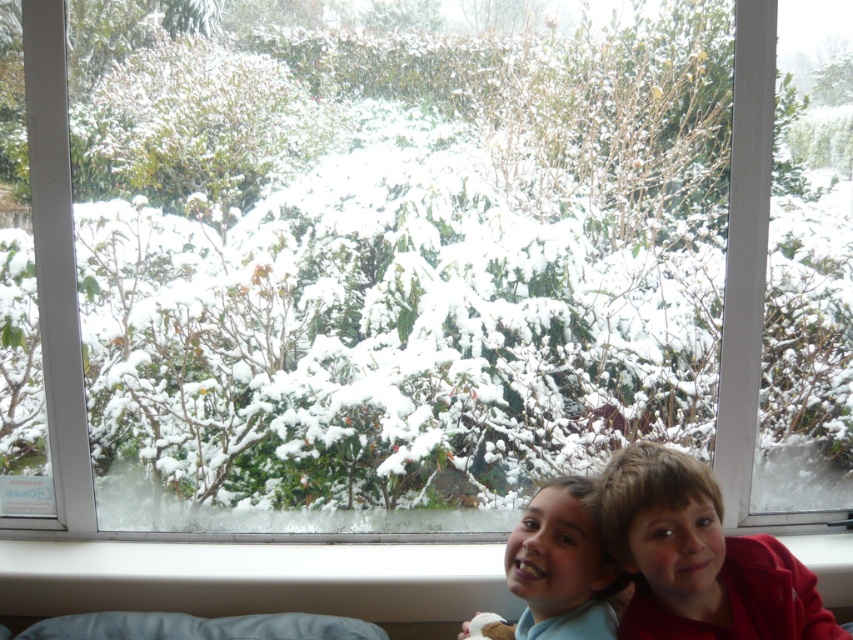
Locate an element on the screen. smooth skin child at lower center is located at coordinates (561, 564).

Which is more to the right, smooth skin child at lower center or white soft pillow at lower center?

smooth skin child at lower center

In the scene shown: Who is more forward, (x=560, y=612) or (x=105, y=632)?

Point (x=560, y=612) is more forward.

Where is `smooth skin child at lower center`? This screenshot has height=640, width=853. smooth skin child at lower center is located at coordinates (561, 564).

Can you confirm if white plastic window sill at lower center is taller than white soft pillow at lower center?

Yes.

Does white plastic window sill at lower center appear on the left side of white soft pillow at lower center?

No, white plastic window sill at lower center is not to the left of white soft pillow at lower center.

Is point (828, 556) more distant than point (302, 627)?

Yes, it is behind point (302, 627).

Where is `white plastic window sill at lower center`? The image size is (853, 640). white plastic window sill at lower center is located at coordinates (254, 579).

Is red cotton shirt at lower right taller than smooth skin child at lower center?

Incorrect, red cotton shirt at lower right's height is not larger of smooth skin child at lower center's.

Between point (689, 624) and point (546, 504), which one is positioned behind?

Positioned behind is point (546, 504).

I want to click on red cotton shirt at lower right, so click(698, 557).